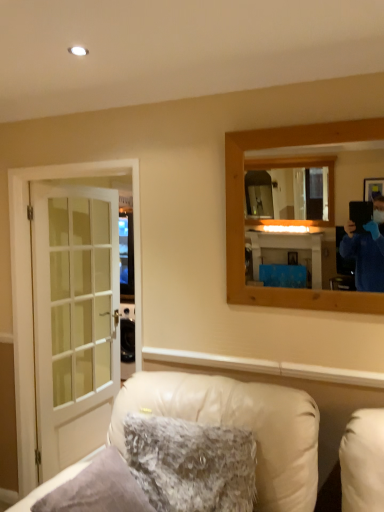
Question: From a real-world perspective, is white leather chair at lower center positioned above or below fuzzy fabric pillow at lower center?

Choices:
 (A) below
 (B) above

Answer: (A)

Question: Is white leather chair at lower center inside or outside of fuzzy fabric pillow at lower center?

Choices:
 (A) outside
 (B) inside

Answer: (A)

Question: Estimate the real-world distances between objects in this image. Which object is farther from the white glass door at left?

Choices:
 (A) wooden mirror at upper right
 (B) white leather chair at lower center
 (C) fuzzy fabric pillow at lower center

Answer: (A)

Question: Considering the real-world distances, which object is closest to the fuzzy fabric pillow at lower center?

Choices:
 (A) wooden mirror at upper right
 (B) white glass door at left
 (C) white leather chair at lower center

Answer: (C)